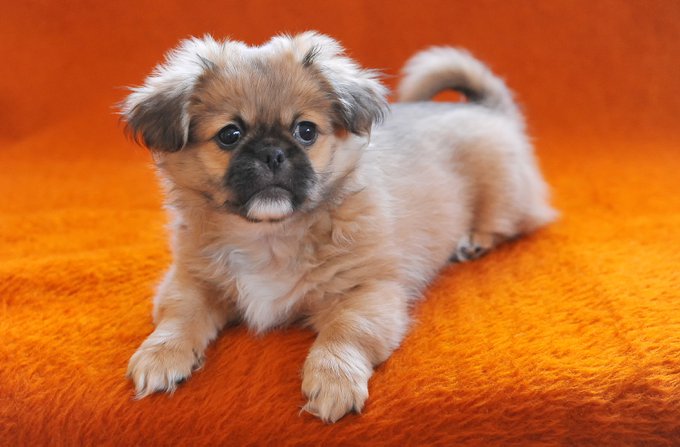
Locate an element on the screen. orange carpet is located at coordinates (54, 363).